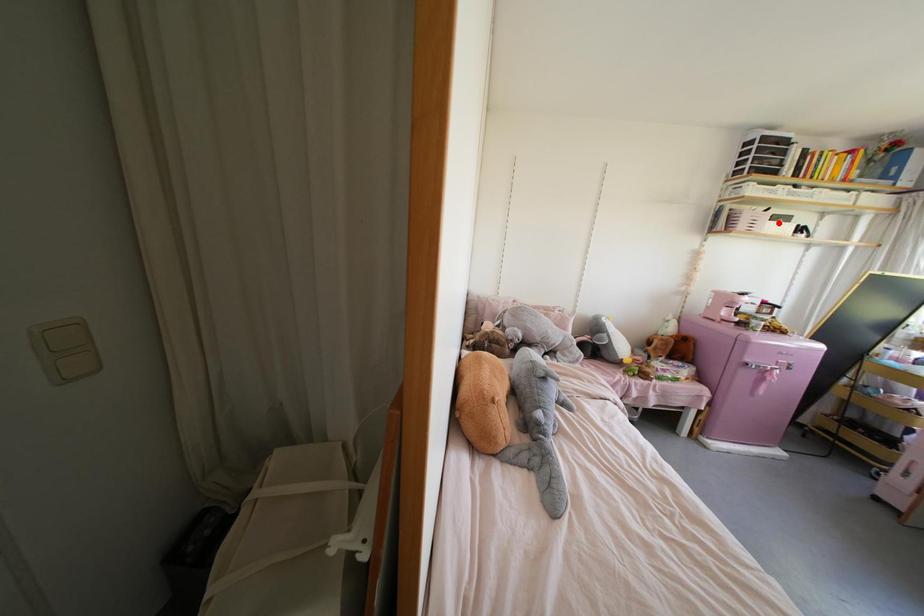
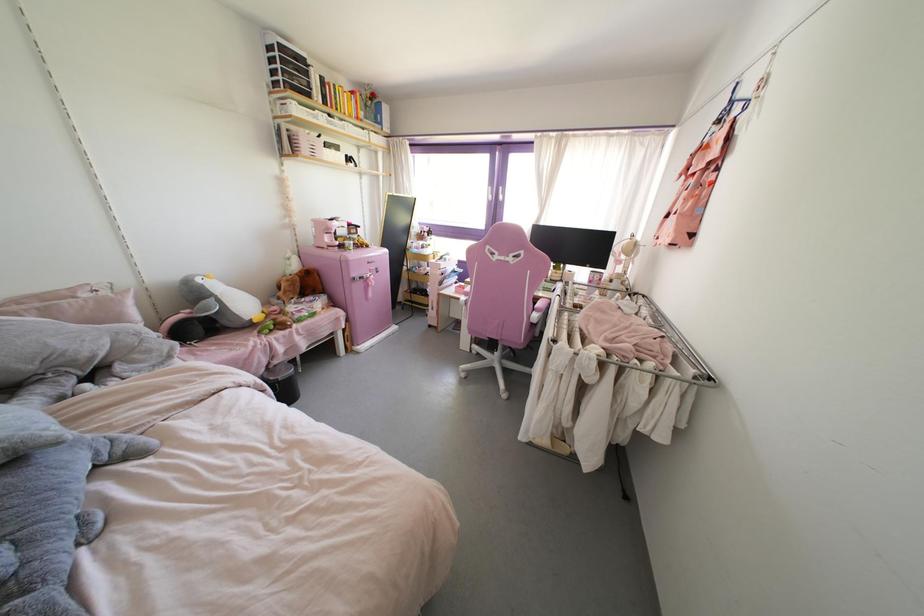
Where in the second image is the point corresponding to the highlighted location from the first image?

(333, 151)